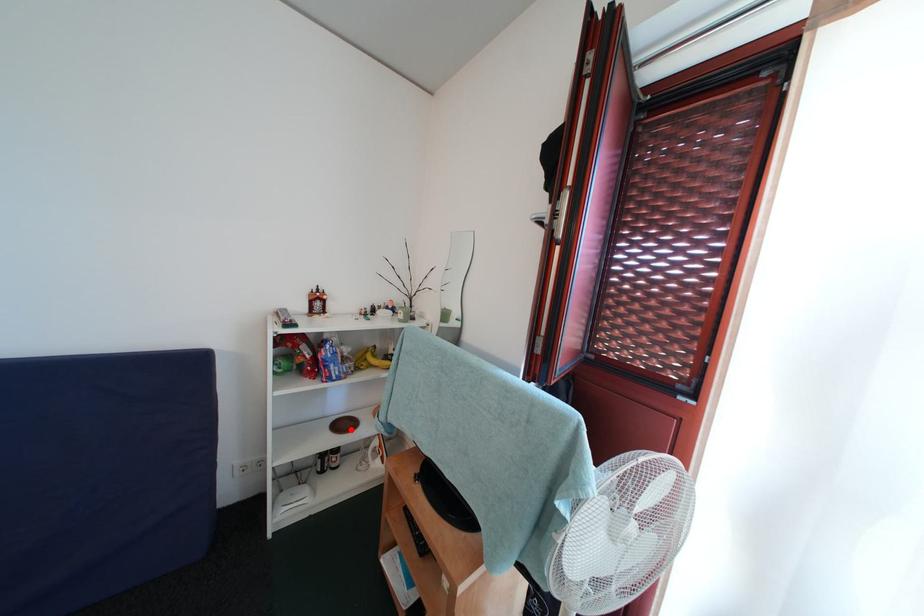
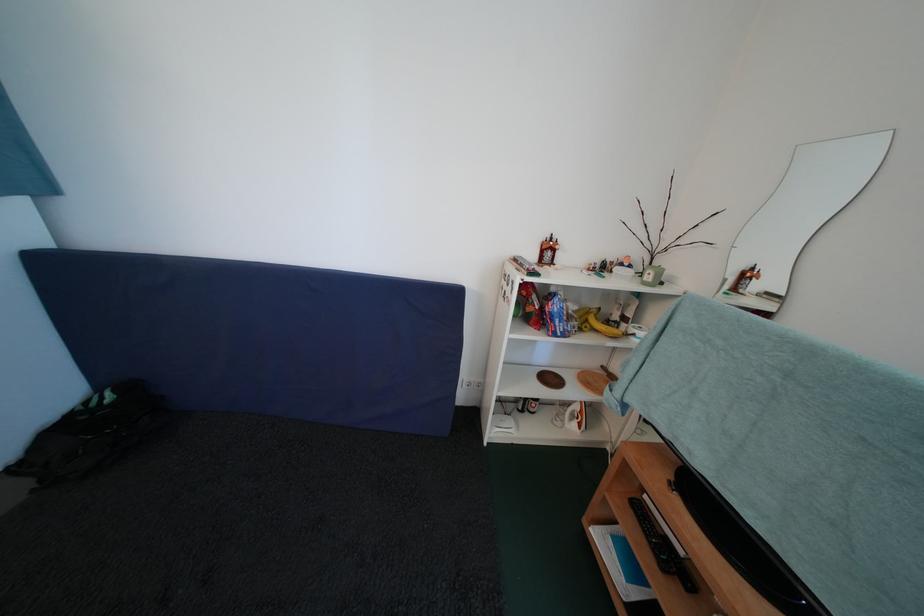
Where in the second image is the point corresponding to the highlighted location from the first image?

(556, 384)